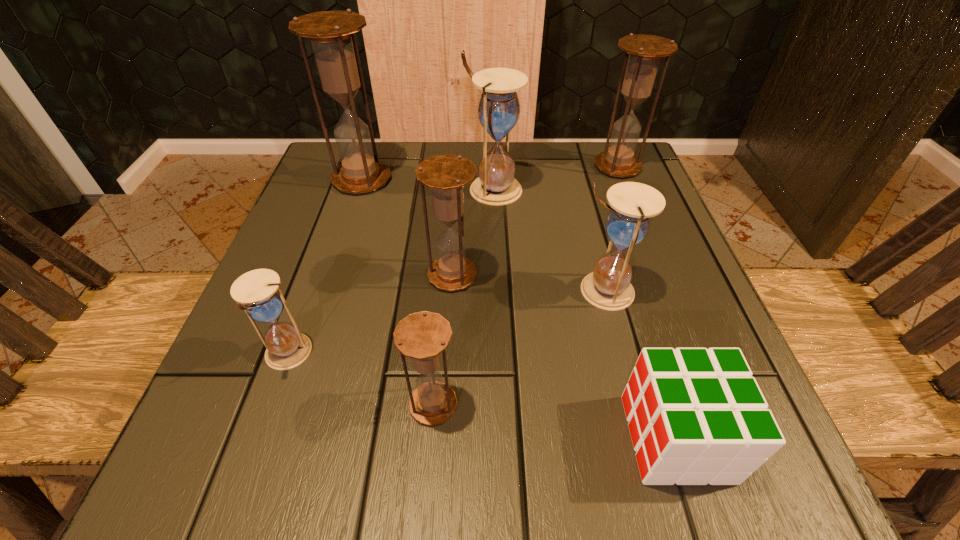
At what (x,y) coordinates should I click in order to perform the action: click on vacant space that is in between the tallest object and the second farthest white hourglass. Please return your answer as a coordinate pair (x, y). Looking at the image, I should click on (482, 235).

Find the location of a particular element. free space that is in between the nearest brown hourglass and the cube is located at coordinates (555, 421).

Where is `free space between the leftmost white hourglass and the leftmost brown hourglass`? This screenshot has height=540, width=960. free space between the leftmost white hourglass and the leftmost brown hourglass is located at coordinates (324, 267).

Locate an element on the screen. Image resolution: width=960 pixels, height=540 pixels. empty space between the tallest object and the nearest hourglass is located at coordinates (397, 292).

Point out which object is positioned as the seventh nearest to the leftmost white hourglass. Please provide its 2D coordinates. Your answer should be formatted as a tuple, i.e. [(x, y)], where the tuple contains the x and y coordinates of a point satisfying the conditions above.

[(645, 51)]

Point out which object is positioned as the second nearest to the nearest brown hourglass. Please provide its 2D coordinates. Your answer should be formatted as a tuple, i.e. [(x, y)], where the tuple contains the x and y coordinates of a point satisfying the conditions above.

[(446, 175)]

Select which hourglass is the third closest to the rightmost white hourglass. Please provide its 2D coordinates. Your answer should be formatted as a tuple, i.e. [(x, y)], where the tuple contains the x and y coordinates of a point satisfying the conditions above.

[(422, 336)]

You are a GUI agent. You are given a task and a screenshot of the screen. Output one action in this format:
    pyautogui.click(x=<x>, y=<y>)
    Task: Click on the closest hourglass to the third farthest brown hourglass
    Image resolution: width=960 pixels, height=540 pixels.
    Given the screenshot: What is the action you would take?
    pyautogui.click(x=498, y=111)

I want to click on the fourth closest brown hourglass relative to the leftmost white hourglass, so click(645, 51).

Identify the location of brown hourglass that is the third closest to the second smallest brown hourglass. The image size is (960, 540). (645, 51).